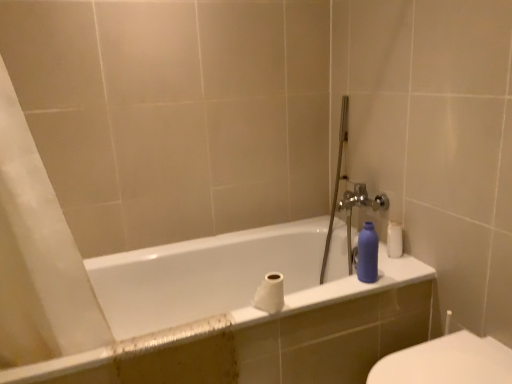
Where is `spots to the right of matte plastic bottle at right`? This screenshot has height=384, width=512. spots to the right of matte plastic bottle at right is located at coordinates (396, 277).